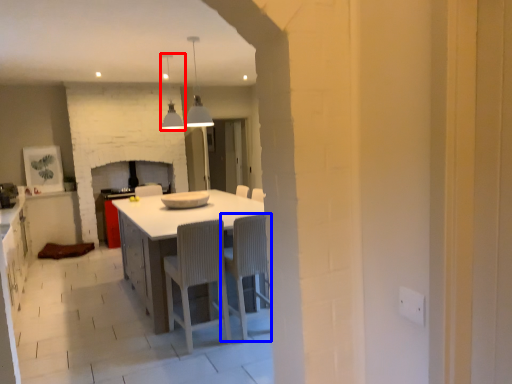
Question: Among these objects, which one is nearest to the camera, light fixture (highlighted by a red box) or chair (highlighted by a blue box)?

Choices:
 (A) light fixture
 (B) chair

Answer: (B)